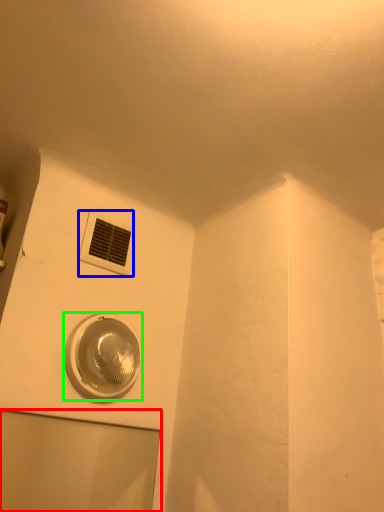
Question: Which is farther away from glass door (highlighted by a red box)? air conditioning (highlighted by a blue box) or home appliance (highlighted by a green box)?

Choices:
 (A) air conditioning
 (B) home appliance

Answer: (A)